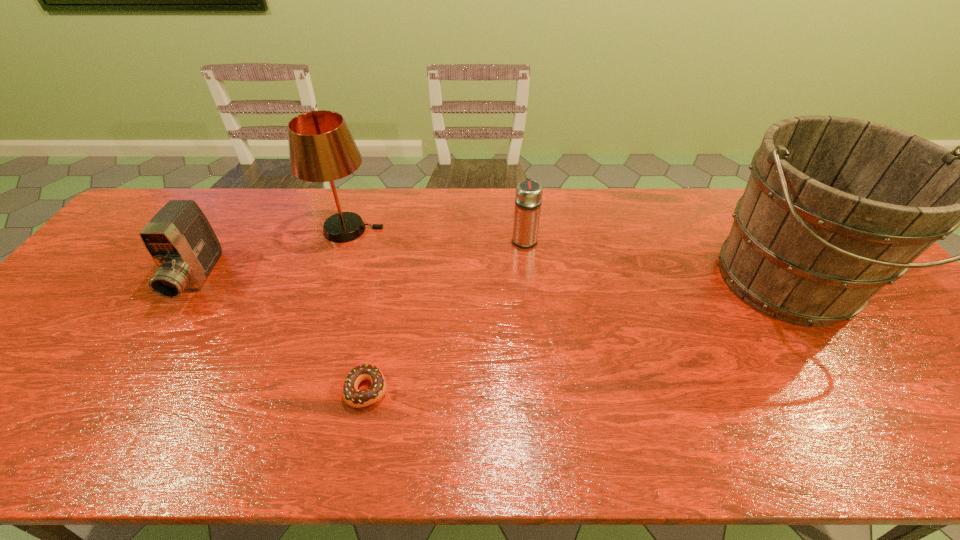
In the image, there is a desktop. At what (x,y) coordinates should I click in order to perform the action: click on vacant space at the left edge. Please return your answer as a coordinate pair (x, y). Image resolution: width=960 pixels, height=540 pixels. Looking at the image, I should click on (139, 281).

Where is `vacant space at the right edge of the desktop`? The image size is (960, 540). vacant space at the right edge of the desktop is located at coordinates (903, 342).

The height and width of the screenshot is (540, 960). I want to click on free region at the far left corner of the desktop, so click(143, 217).

Image resolution: width=960 pixels, height=540 pixels. Find the location of `free spot between the fourth object from left to right and the lampshade`. free spot between the fourth object from left to right and the lampshade is located at coordinates coord(437,234).

Where is `vacant area between the leftmost object and the third object from right to left`? vacant area between the leftmost object and the third object from right to left is located at coordinates (282, 334).

Image resolution: width=960 pixels, height=540 pixels. I want to click on vacant space that is in between the thermos bottle and the nearest object, so click(x=445, y=314).

The width and height of the screenshot is (960, 540). I want to click on free area in between the nearest object and the thermos bottle, so click(x=445, y=314).

Identify the location of vacant space in between the fourth object from right to left and the thermos bottle. (437, 234).

Where is `free space between the fourth object from right to left and the leftmost object`? The height and width of the screenshot is (540, 960). free space between the fourth object from right to left and the leftmost object is located at coordinates (273, 254).

Locate an element on the screen. The height and width of the screenshot is (540, 960). blank region between the third object from right to left and the thermos bottle is located at coordinates (445, 314).